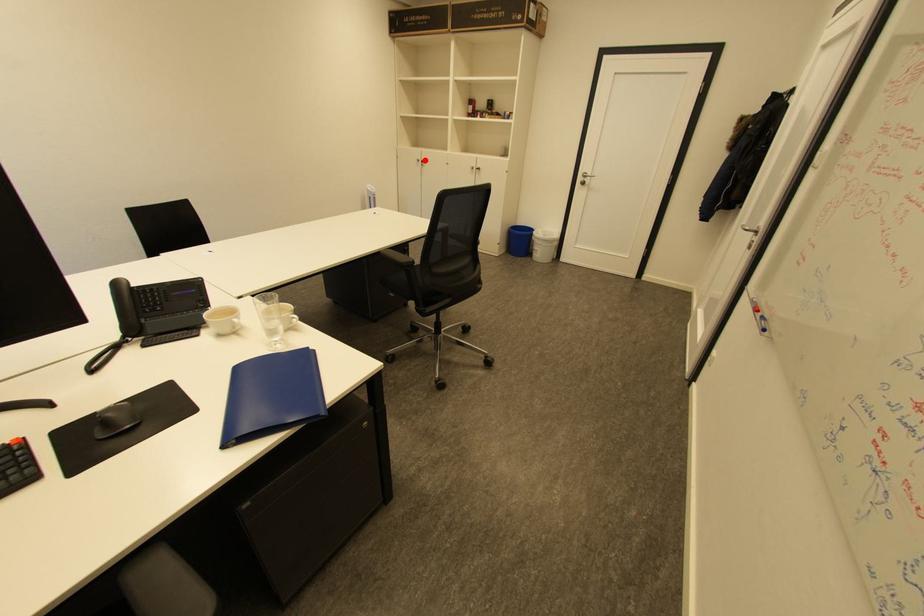
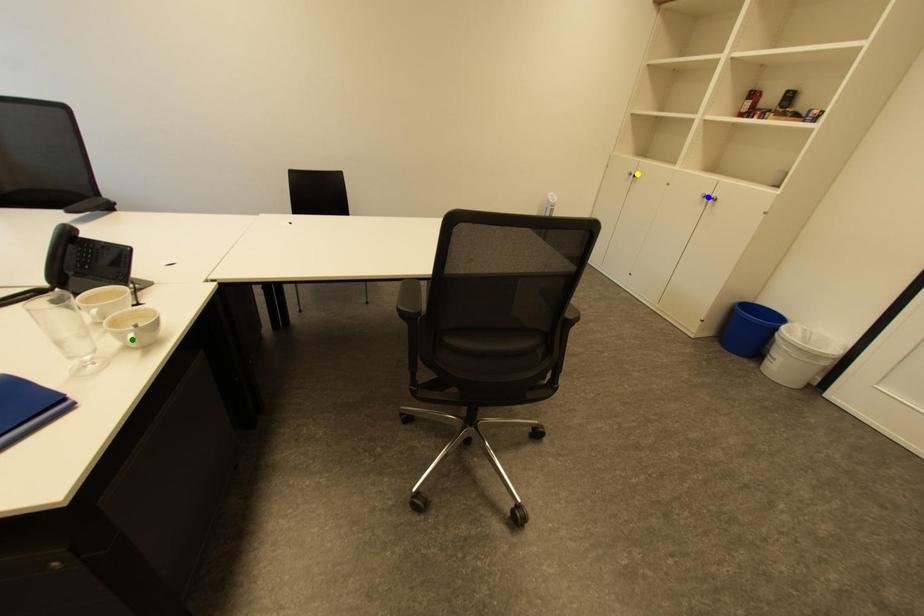
Question: I am providing you with two images of the same scene from different viewpoints. A red point is marked on the first image. You are given multiple points on the second image. Which point in image 2 is actually the same real-world point as the red point in image 1?

Choices:
 (A) yellow point
 (B) green point
 (C) blue point

Answer: (A)